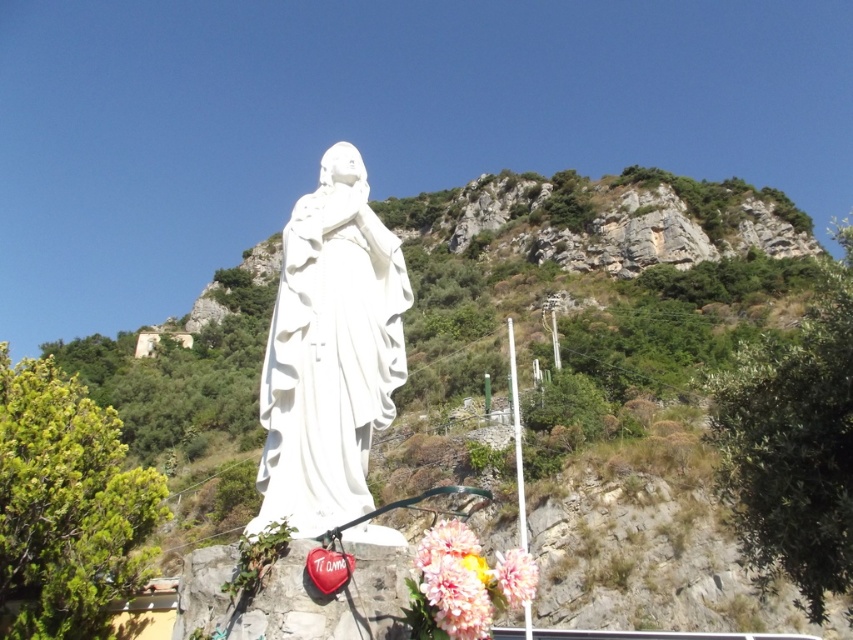
You are a photographer standing at the camera position. You want to take a photo of the white marble statue at center. If your camera can focus on objects up to 50 feet away, will you be able to capture the statue clearly?

The white marble statue at center is 46.03 feet away from the camera. Since the camera can focus up to 50 feet, you can capture the statue clearly within the focus range.

You are an artist planning to paint the scene. You want to ensure the green leafy hillside at center and the pastel pink fabric flowers at lower center are proportionally accurate. Which object should you make larger in your painting?

The green leafy hillside at center should be made larger than the pastel pink fabric flowers at lower center because it is bigger in the original scene.

You are a photographer planning to take a closeup shot of the fluffy silk flower at lower center. You want to ensure the white marble statue at center is still visible in the background. Is the statue large enough to be seen clearly in the background while focusing on the flower?

The white marble statue at center is larger in size than the fluffy silk flower at lower center. Since the statue is larger, it will remain visible in the background even when focusing on the flower, as its size ensures it doesn not get lost in the frame.